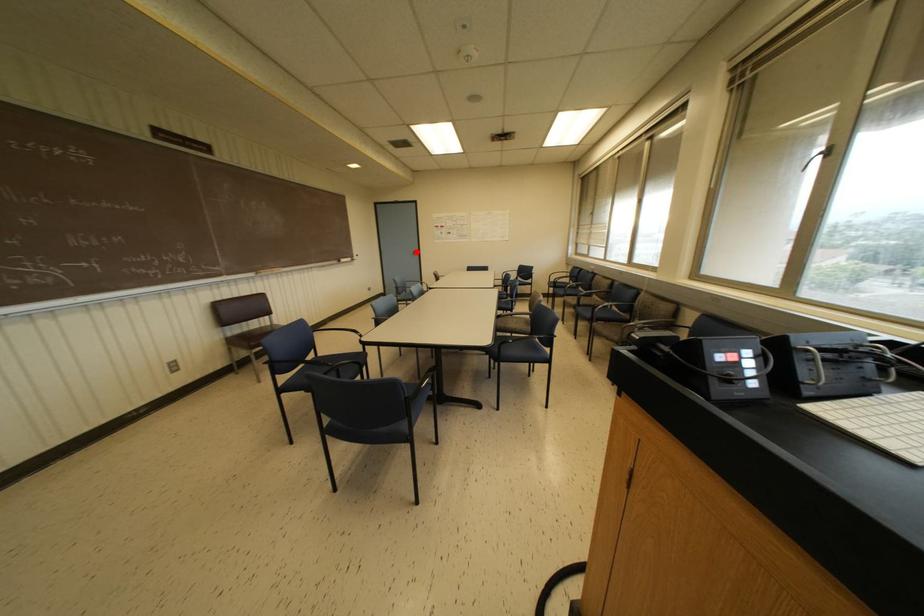
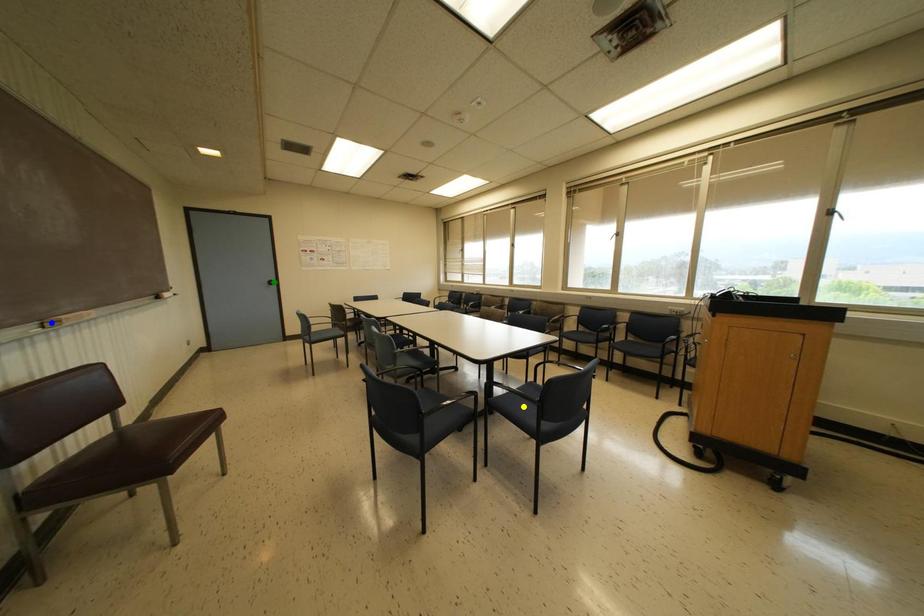
Question: I am providing you with two images of the same scene from different viewpoints. A red point is marked on the first image. You are given multiple points on the second image. In image 2, which mark is for the same physical point as the one in image 1?

Choices:
 (A) blue point
 (B) green point
 (C) yellow point

Answer: (B)